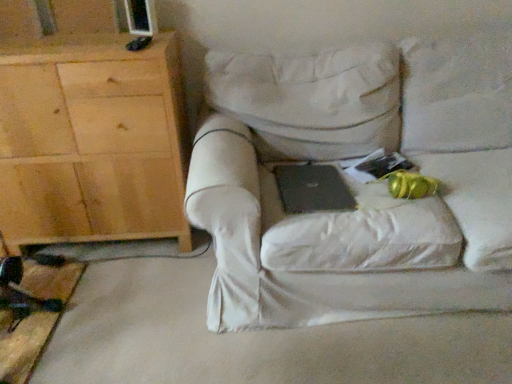
Question: From the image's perspective, is light wood cabinet at left located beneath black matte laptop at center?

Choices:
 (A) no
 (B) yes

Answer: (A)

Question: From a real-world perspective, is light wood cabinet at left on top of black matte laptop at center?

Choices:
 (A) no
 (B) yes

Answer: (B)

Question: Is light wood cabinet at left facing towards black matte laptop at center?

Choices:
 (A) yes
 (B) no

Answer: (B)

Question: Is light wood cabinet at left taller than black matte laptop at center?

Choices:
 (A) yes
 (B) no

Answer: (A)

Question: Does light wood cabinet at left touch black matte laptop at center?

Choices:
 (A) no
 (B) yes

Answer: (A)

Question: Is light wood cabinet at left not within black matte laptop at center?

Choices:
 (A) yes
 (B) no

Answer: (A)

Question: Is white fabric chair at center smaller than light wood cabinet at left?

Choices:
 (A) no
 (B) yes

Answer: (A)

Question: Does white fabric chair at center contain light wood cabinet at left?

Choices:
 (A) yes
 (B) no

Answer: (B)

Question: Are white fabric chair at center and light wood cabinet at left located far from each other?

Choices:
 (A) no
 (B) yes

Answer: (A)

Question: Is white fabric chair at center at the right side of light wood cabinet at left?

Choices:
 (A) no
 (B) yes

Answer: (B)

Question: From a real-world perspective, is white fabric chair at center located higher than light wood cabinet at left?

Choices:
 (A) yes
 (B) no

Answer: (B)

Question: From the image's perspective, is white fabric chair at center below light wood cabinet at left?

Choices:
 (A) yes
 (B) no

Answer: (A)

Question: Is white fabric chair at center thinner than black matte laptop at center?

Choices:
 (A) no
 (B) yes

Answer: (A)